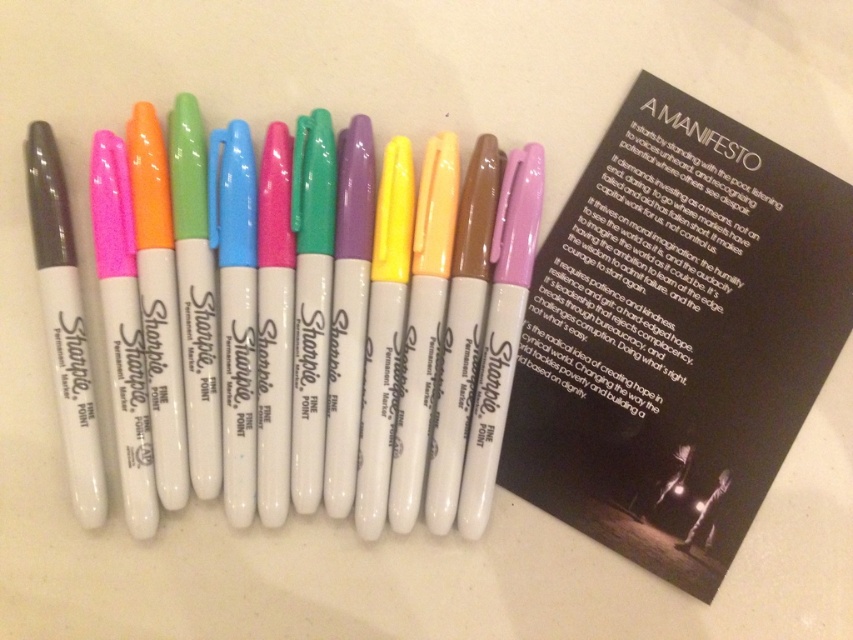
Question: Does matte white marker at center have a smaller size compared to matte gray pen at left?

Choices:
 (A) yes
 (B) no

Answer: (B)

Question: Considering the relative positions of matte white marker at center and matte gray pen at left in the image provided, where is matte white marker at center located with respect to matte gray pen at left?

Choices:
 (A) right
 (B) left

Answer: (A)

Question: Does matte white marker at center appear under matte gray pen at left?

Choices:
 (A) yes
 (B) no

Answer: (B)